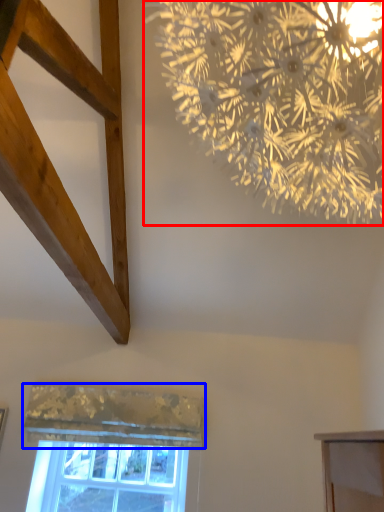
Question: Which object appears farthest to the camera in this image, flower (highlighted by a red box) or curtain (highlighted by a blue box)?

Choices:
 (A) flower
 (B) curtain

Answer: (B)